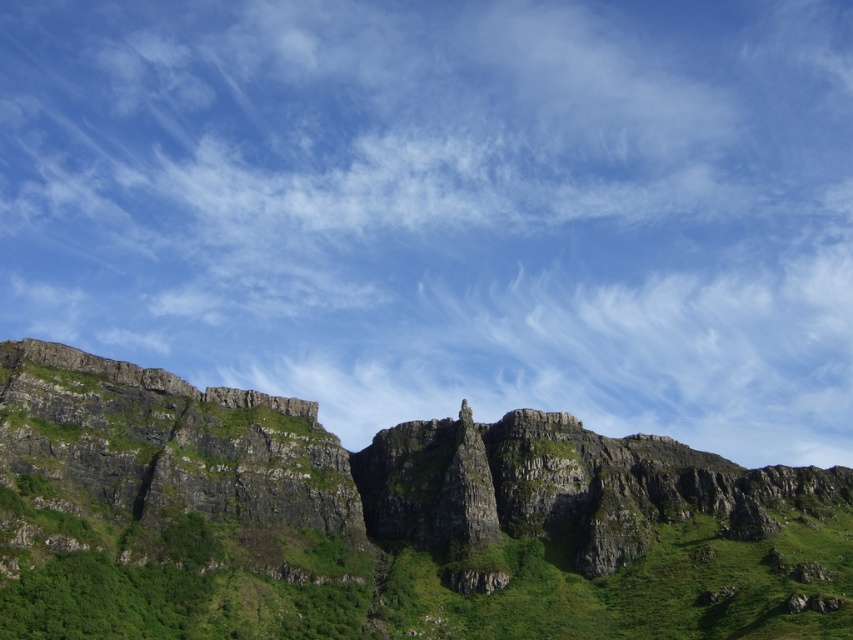
The width and height of the screenshot is (853, 640). Describe the element at coordinates (447, 208) in the screenshot. I see `white fluffy cloud at upper center` at that location.

Who is higher up, white fluffy cloud at upper center or rocky cliff at center?

white fluffy cloud at upper center

Measure the distance between white fluffy cloud at upper center and camera.

They are 320.71 feet apart.

Identify the location of white fluffy cloud at upper center. (447, 208).